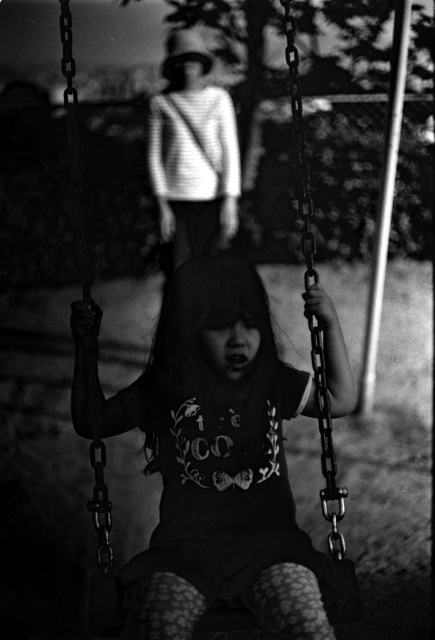
In the scene shown: You are a photographer trying to capture a clear shot of the dark fabric shirt at center. Given that the focus point is set to the coordinates point (210,452), will the dark fabric shirt at center be in focus?

The point (210,452) corresponds to the dark fabric shirt at center, so yes, the dark fabric shirt at center will be in focus since the focus point is set to that coordinate.

Based on the scene description, which object is wider between the dark fabric shirt at center and the striped sweater at upper center?

The dark fabric shirt at center is wider than the striped sweater at upper center according to the description.

You are a photographer standing 2 meters away from the dark fabric shirt at center. Can you take a clear photo of it without moving closer?

The dark fabric shirt at center is 2.11 meters away from the camera, so you can take a clear photo without moving closer since it is slightly farther than your current position.